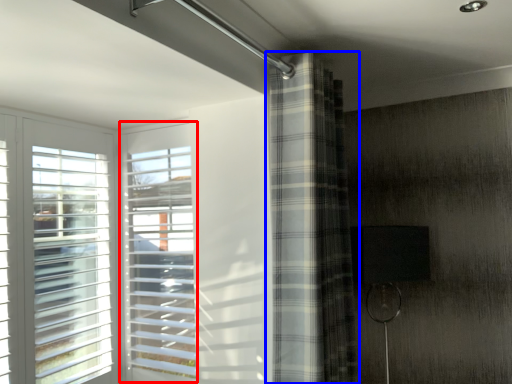
Question: Which point is closer to the camera, window (highlighted by a red box) or curtain (highlighted by a blue box)?

Choices:
 (A) window
 (B) curtain

Answer: (B)